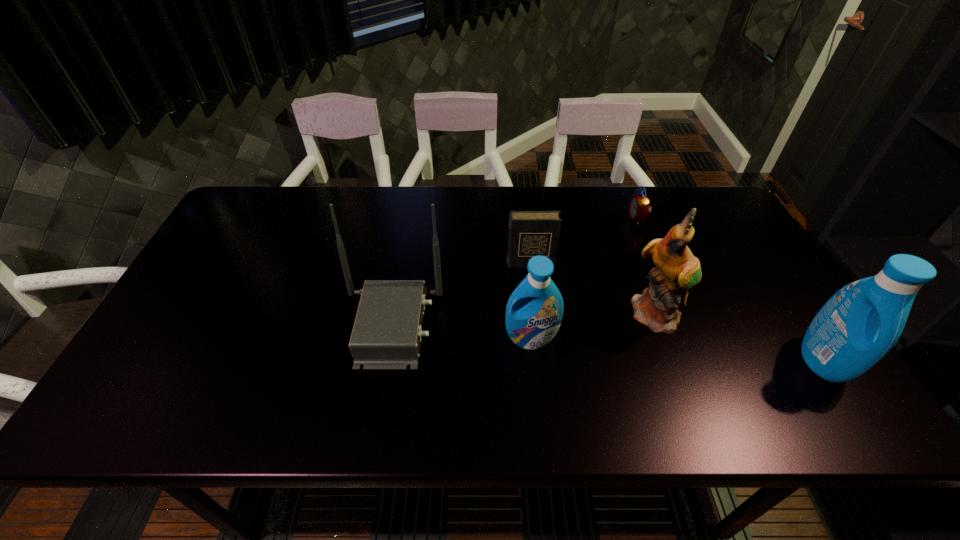
The width and height of the screenshot is (960, 540). Find the location of `object positioned at the right edge`. object positioned at the right edge is located at coordinates (857, 327).

In order to click on object that is at the near right corner in this screenshot , I will do `click(857, 327)`.

Where is `vacant space at the far edge of the desktop`? The image size is (960, 540). vacant space at the far edge of the desktop is located at coordinates (402, 231).

You are a GUI agent. You are given a task and a screenshot of the screen. Output one action in this format:
    pyautogui.click(x=<x>, y=<y>)
    Task: Click on the free location at the near edge
    
    Given the screenshot: What is the action you would take?
    pyautogui.click(x=448, y=382)

In the image, there is a desktop. At what (x,y) coordinates should I click in order to perform the action: click on free space at the left edge. Please return your answer as a coordinate pair (x, y). The image size is (960, 540). Looking at the image, I should click on (217, 293).

Where is `vacant space at the right edge`? vacant space at the right edge is located at coordinates (729, 238).

The width and height of the screenshot is (960, 540). I want to click on vacant space at the far left corner of the desktop, so click(278, 219).

Locate an element on the screen. unoccupied area between the diary and the router is located at coordinates (461, 295).

This screenshot has width=960, height=540. In order to click on blank region between the shortest object and the router in this screenshot , I will do (x=515, y=272).

Locate an element on the screen. This screenshot has width=960, height=540. free space between the shortest object and the fourth tallest object is located at coordinates (585, 279).